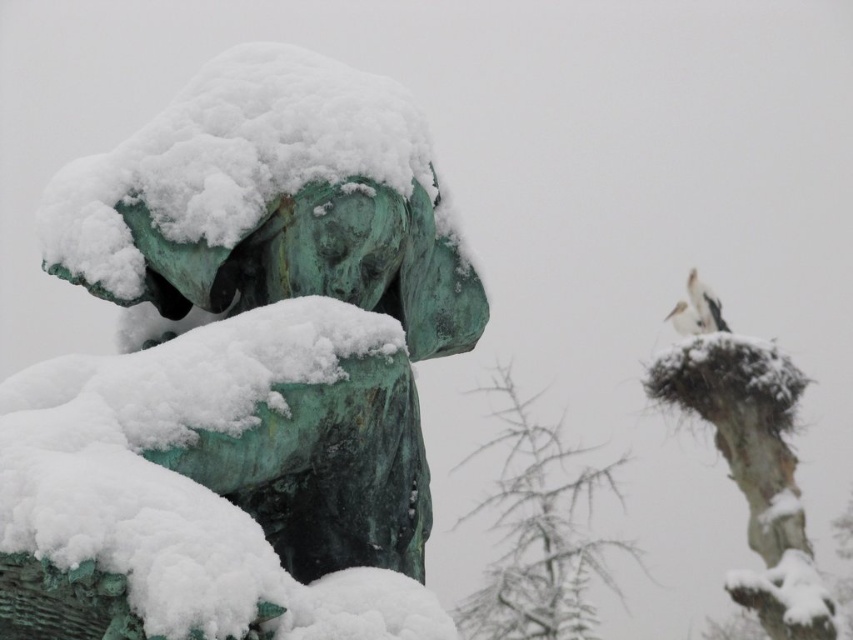
Looking at this image, you are an observer standing in the winter scene. You notice the green patina statue at center and the white feathered bird at upper right. Which object is positioned higher in the image?

The green patina statue at center is located above the white feathered bird at upper right, so it is positioned higher in the image.

You are an ornithologist observing the winter scene. You need to determine the spatial relationship between the green patina statue at center and the white matte bird at upper right. Is the statue obscuring your view of the bird?

The green patina statue at center is positioned over white matte bird at upper right, so yes, the statue is obscuring your view of the bird.